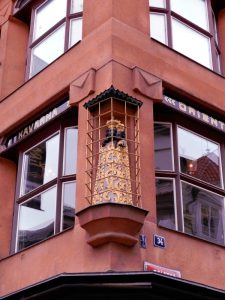
Where is `below window`? The height and width of the screenshot is (300, 225). below window is located at coordinates (8, 267), (50, 266), (121, 256), (210, 253).